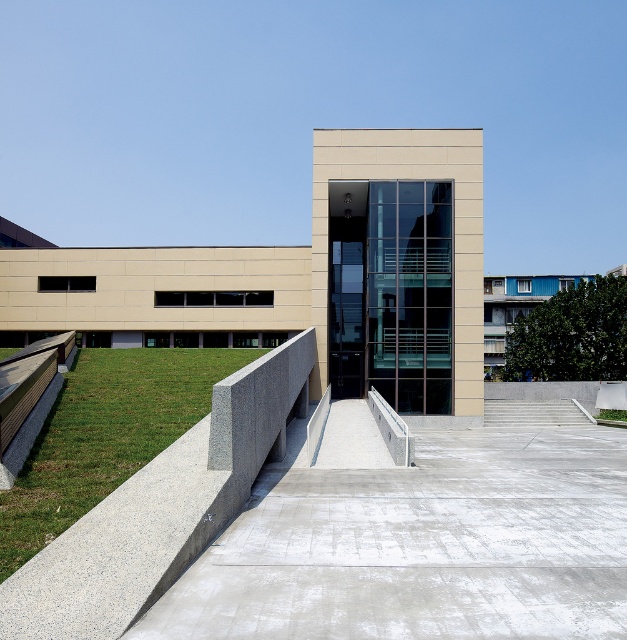
You are a landscape architect planning to install a new pathway between the green grass at lower left and the concrete stairs at center. Which area has more space available for the pathway?

The green grass at lower left has a greater width than the concrete stairs at center, so it offers more space for the pathway.

You are standing at the entrance of the modern architectural structure. You notice a gray concrete area marked at point (423,545). Based on the scene description, can you determine the location of this gray concrete area relative to the main building?

The gray concrete at center is located at point (423,545), which is in the center of the scene. Since the main building is described as the central structure, the gray concrete area is likely positioned at the center of the building or its immediate vicinity.